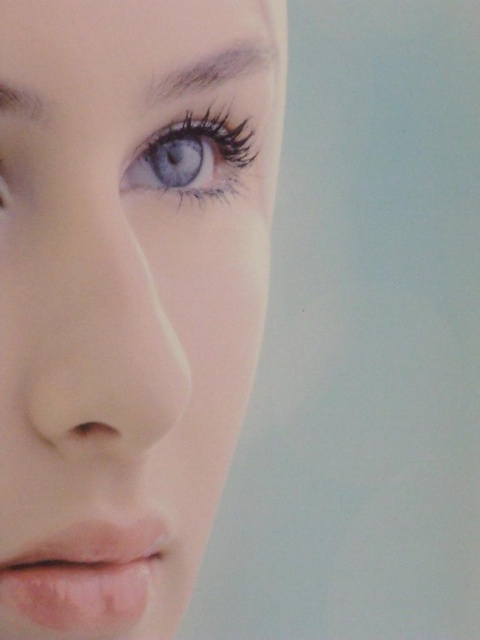
From the picture: You are a makeup artist preparing to apply eyeliner to the gray matte eyebrow at upper left. You need to ensure that the eyeliner doesn not extend beyond the boundaries of the smooth skin face at upper left. Given their sizes, is this possible?

The smooth skin face at upper left is bigger than the gray matte eyebrow at upper left, so yes, the eyeliner can be applied without extending beyond the boundaries of the smooth skin face at upper left since the face area is larger.

You are a photographer using a camera with a focal length of 50mm. You want to capture a close portrait of the smooth skin face at upper left. According to the rule of thirds, where should you position the face in the frame?

According to the rule of thirds, you should position the smooth skin face at upper left at one of the intersection points of the grid to create a balanced and engaging composition.